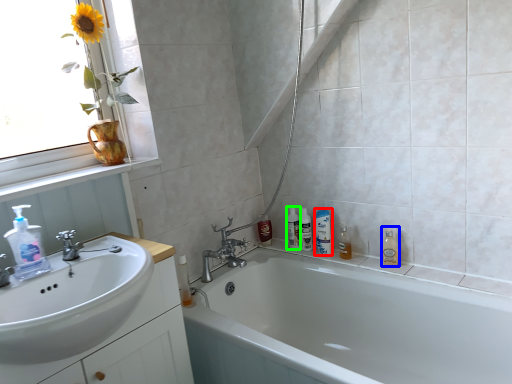
Question: Based on their relative distances, which object is farther from mouthwash (highlighted by a red box)? Choose from cleaning product (highlighted by a blue box) and toiletry (highlighted by a green box).

Choices:
 (A) cleaning product
 (B) toiletry

Answer: (A)